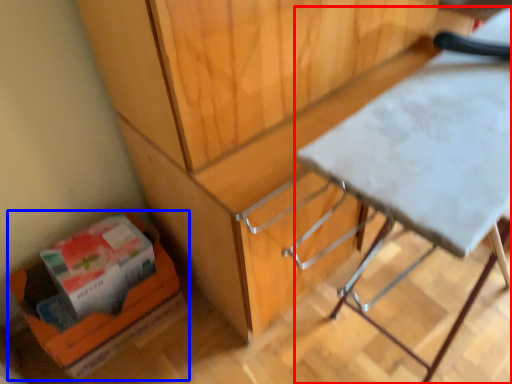
Question: Among these objects, which one is farthest to the camera, table (highlighted by a red box) or cardboard box (highlighted by a blue box)?

Choices:
 (A) table
 (B) cardboard box

Answer: (B)